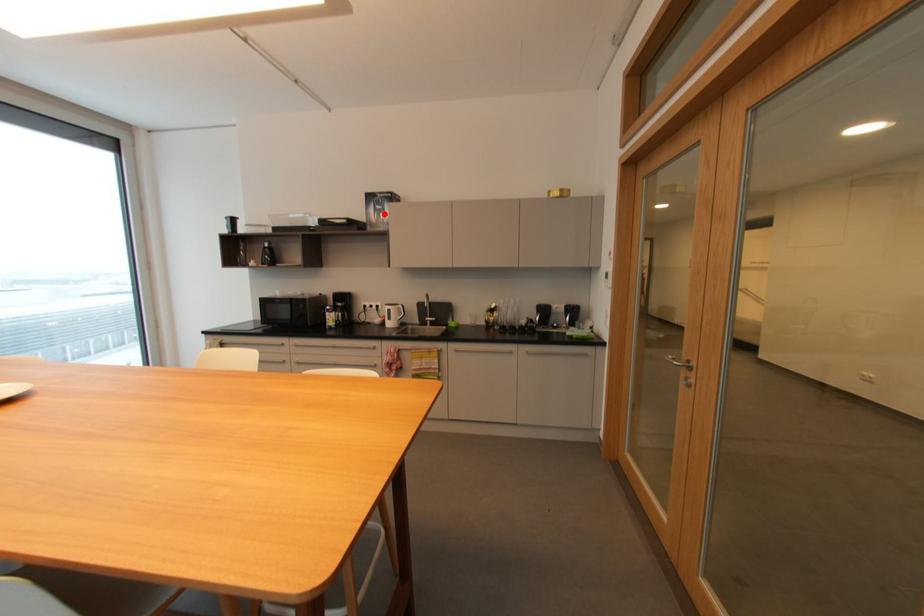
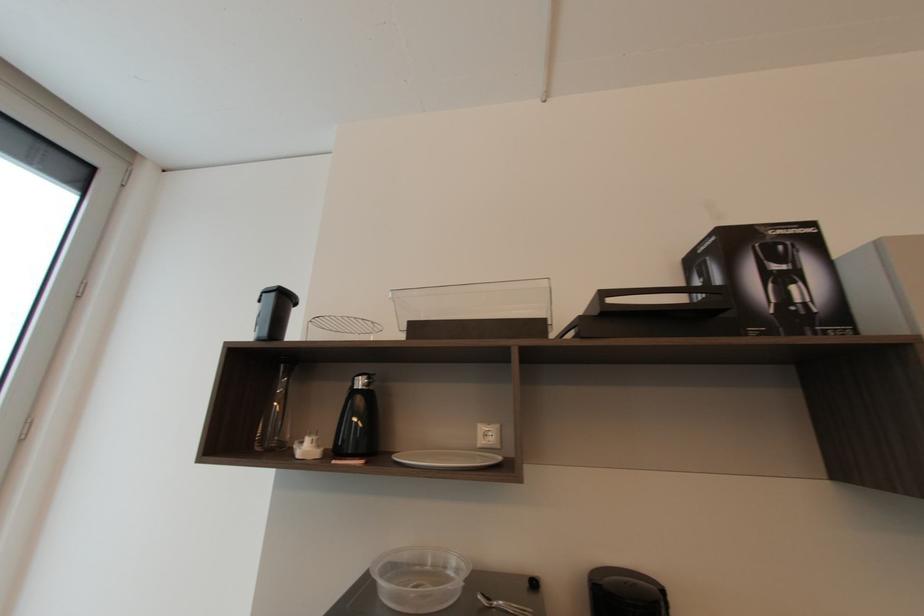
Question: I am providing you with two images of the same scene from different viewpoints. A red point is marked on the first image. Is the red point's position out of view in image 2?

Choices:
 (A) Yes
 (B) No

Answer: (B)